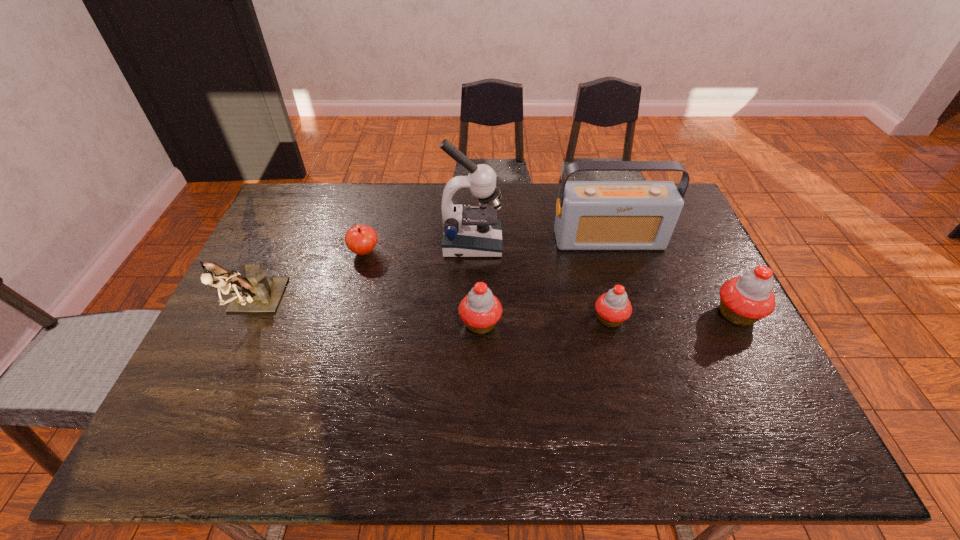
This screenshot has width=960, height=540. What are the coordinates of `vacant area between the figurine and the second tallest cupcake` in the screenshot? It's located at (367, 315).

Where is `free space between the radio receiver and the shortest cupcake`? The height and width of the screenshot is (540, 960). free space between the radio receiver and the shortest cupcake is located at coordinates (610, 279).

Identify which object is located as the fifth nearest to the tallest object. Please provide its 2D coordinates. Your answer should be formatted as a tuple, i.e. [(x, y)], where the tuple contains the x and y coordinates of a point satisfying the conditions above.

[(253, 291)]

The height and width of the screenshot is (540, 960). I want to click on object that stands as the fourth closest to the second cupcake from left to right, so click(474, 232).

Locate an element on the screen. the closest cupcake to the leftmost object is located at coordinates (480, 310).

You are a GUI agent. You are given a task and a screenshot of the screen. Output one action in this format:
    pyautogui.click(x=<x>, y=<y>)
    Task: Click on the cupcake identified as the closest to the tallest object
    This screenshot has height=540, width=960.
    Given the screenshot: What is the action you would take?
    pyautogui.click(x=480, y=310)

Image resolution: width=960 pixels, height=540 pixels. I want to click on free space that satisfies the following two spatial constraints: 1. on the back side of the rightmost cupcake; 2. at the eyepiece of the microscope, so click(x=700, y=244).

Locate an element on the screen. This screenshot has width=960, height=540. free space that satisfies the following two spatial constraints: 1. at the eyepiece of the tallest object; 2. on the right side of the second cupcake from left to right is located at coordinates (470, 319).

Identify the location of vacant space that satisfies the following two spatial constraints: 1. at the eyepiece of the microscope; 2. on the front-facing side of the figurine. The image size is (960, 540). (470, 306).

Where is `free location that satisfies the following two spatial constraints: 1. on the back side of the leftmost cupcake; 2. on the right side of the rightmost object`? This screenshot has width=960, height=540. free location that satisfies the following two spatial constraints: 1. on the back side of the leftmost cupcake; 2. on the right side of the rightmost object is located at coordinates (480, 314).